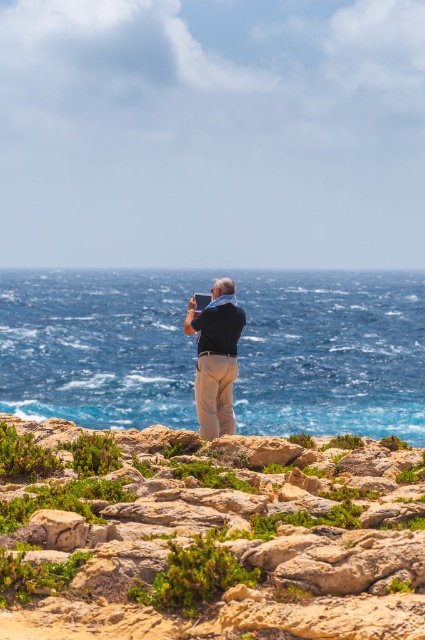
Question: Which object is closer to the camera taking this photo?

Choices:
 (A) matte black shirt at center
 (B) rugged stone shoreline at center
 (C) blue water at center

Answer: (B)

Question: Observing the image, what is the correct spatial positioning of rugged stone shoreline at center in reference to matte black shirt at center?

Choices:
 (A) left
 (B) right

Answer: (B)

Question: Does rugged stone shoreline at center appear under blue water at center?

Choices:
 (A) yes
 (B) no

Answer: (A)

Question: Does rugged stone shoreline at center have a lesser width compared to blue water at center?

Choices:
 (A) no
 (B) yes

Answer: (B)

Question: Which object appears closest to the camera in this image?

Choices:
 (A) matte black shirt at center
 (B) rugged stone shoreline at center

Answer: (B)

Question: Among these objects, which one is nearest to the camera?

Choices:
 (A) blue water at center
 (B) rugged stone shoreline at center
 (C) matte black shirt at center

Answer: (B)